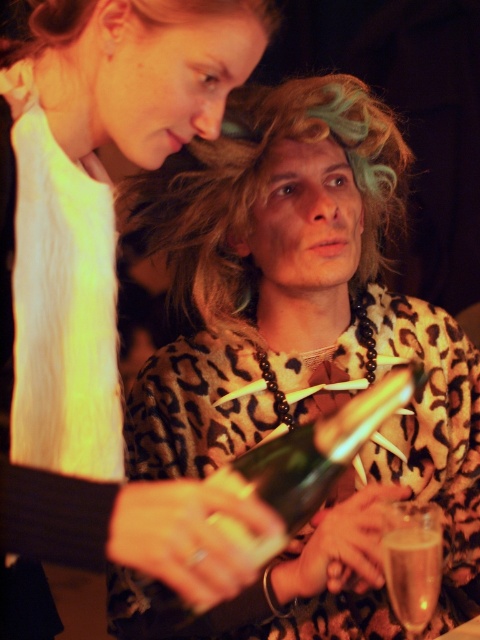
Question: Estimate the real-world distances between objects in this image. Which object is farther from the leopard print sweater at center?

Choices:
 (A) clear glass at lower right
 (B) matte white shirt at upper left

Answer: (B)

Question: Estimate the real-world distances between objects in this image. Which object is closer to the matte white shirt at upper left?

Choices:
 (A) clear glass at lower right
 (B) leopard print sweater at center

Answer: (B)

Question: Considering the relative positions of leopard print sweater at center and clear glass at lower right in the image provided, where is leopard print sweater at center located with respect to clear glass at lower right?

Choices:
 (A) above
 (B) below

Answer: (A)

Question: Is matte white shirt at upper left bigger than clear glass at lower right?

Choices:
 (A) yes
 (B) no

Answer: (A)

Question: Can you confirm if matte white shirt at upper left is positioned below clear glass at lower right?

Choices:
 (A) no
 (B) yes

Answer: (A)

Question: Considering the real-world distances, which object is closest to the leopard print sweater at center?

Choices:
 (A) clear glass at lower right
 (B) matte white shirt at upper left

Answer: (A)